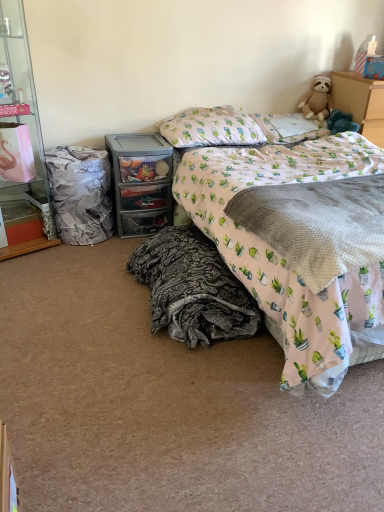
The image size is (384, 512). What are the coordinates of `free point in front of marble-patterned laundry basket at left` in the screenshot? It's located at (63, 259).